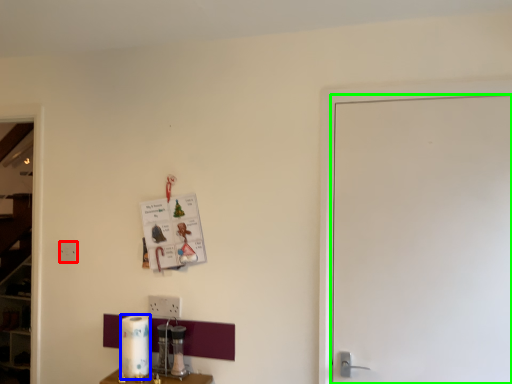
Question: Which is farther away from electric outlet (highlighted by a red box)? paper towel (highlighted by a blue box) or door (highlighted by a green box)?

Choices:
 (A) paper towel
 (B) door

Answer: (B)